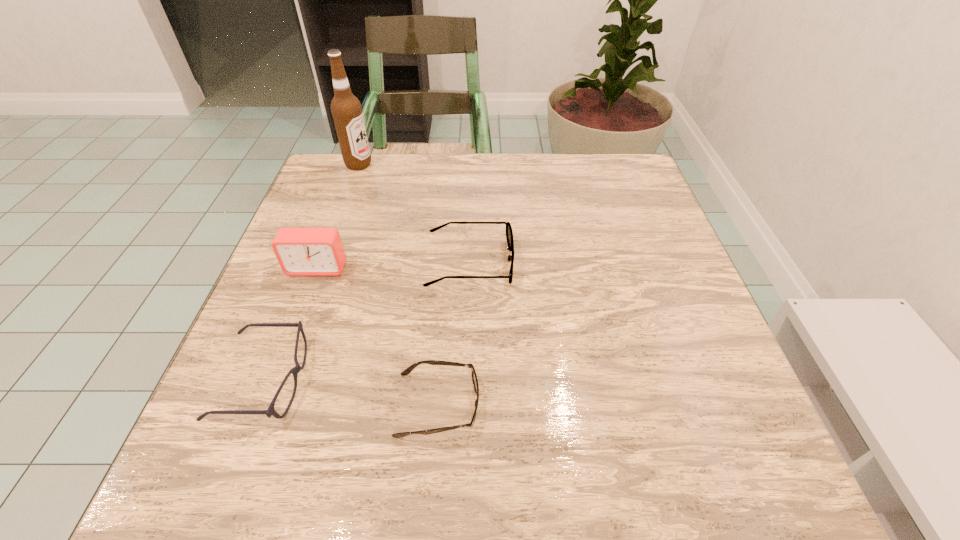
This screenshot has width=960, height=540. In order to click on alcohol in this screenshot , I will do `click(346, 109)`.

Identify the location of the tallest object. This screenshot has height=540, width=960. (346, 109).

The height and width of the screenshot is (540, 960). Identify the location of the second tallest object. (300, 251).

At what (x,y) coordinates should I click in order to perform the action: click on the farthest spectacles. Please return your answer as a coordinate pair (x, y). The height and width of the screenshot is (540, 960). Looking at the image, I should click on (509, 233).

This screenshot has width=960, height=540. Identify the location of the leftmost spectacles. (270, 411).

This screenshot has height=540, width=960. Identify the location of the shortest object. (407, 371).

This screenshot has height=540, width=960. Identify the location of vacant area situated 0.160m on the label of the alcohol. (432, 164).

What are the coordinates of `blank area located on the front-facing side of the second tallest object` in the screenshot? It's located at (276, 383).

The width and height of the screenshot is (960, 540). I want to click on free space located on the front-facing side of the farthest spectacles, so click(x=676, y=262).

This screenshot has height=540, width=960. I want to click on vacant region located 0.180m on the front-facing side of the leftmost spectacles, so click(x=417, y=381).